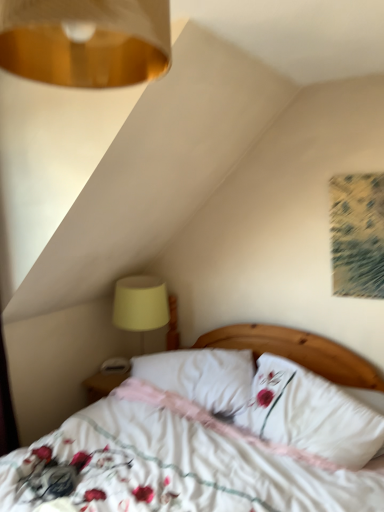
The width and height of the screenshot is (384, 512). What are the coordinates of `white soft pillow at center, the 1th pillow positioned from the right` in the screenshot? It's located at (310, 414).

Locate an element on the screen. white floral fabric bed at center is located at coordinates (180, 463).

What is the approximate width of white floral fabric bed at center?

It is 5.53 feet.

What do you see at coordinates (140, 304) in the screenshot?
I see `yellow fabric lampshade at lower left` at bounding box center [140, 304].

You are a GUI agent. You are given a task and a screenshot of the screen. Output one action in this format:
    pyautogui.click(x=<x>, y=<y>)
    Task: Click on the gold metallic lampshade at upper left
    This screenshot has height=512, width=384.
    Given the screenshot: What is the action you would take?
    pyautogui.click(x=85, y=41)

I want to click on white soft pillow at center, arranged as the first pillow when viewed from the left, so click(x=201, y=376).

Is yellow fabric lampshade at lower left not within white soft pillow at center, arranged as the first pillow when viewed from the left?

Yes, yellow fabric lampshade at lower left is outside of white soft pillow at center, arranged as the first pillow when viewed from the left.

Can you confirm if yellow fabric lampshade at lower left is thinner than white soft pillow at center, arranged as the first pillow when viewed from the left?

Correct, the width of yellow fabric lampshade at lower left is less than that of white soft pillow at center, arranged as the first pillow when viewed from the left.

Which object is further away from the camera, yellow fabric lampshade at lower left or white soft pillow at center, the 2th pillow when ordered from right to left?

yellow fabric lampshade at lower left is behind.

Is gold metallic lampshade at upper left facing towards printed fabric artwork at upper right?

No, gold metallic lampshade at upper left is not turned towards printed fabric artwork at upper right.

In the scene shown: Considering the sizes of objects gold metallic lampshade at upper left and printed fabric artwork at upper right in the image provided, who is smaller, gold metallic lampshade at upper left or printed fabric artwork at upper right?

Smaller between the two is printed fabric artwork at upper right.

How many degrees apart are the facing directions of gold metallic lampshade at upper left and printed fabric artwork at upper right?

The angle between the facing direction of gold metallic lampshade at upper left and the facing direction of printed fabric artwork at upper right is 4.93 degrees.

From a real-world perspective, is gold metallic lampshade at upper left physically located above or below printed fabric artwork at upper right?

gold metallic lampshade at upper left is above printed fabric artwork at upper right.

Considering the relative positions of white soft pillow at center, the 2th pillow from the left, and gold metallic lampshade at upper left in the image provided, is white soft pillow at center, the 2th pillow from the left, to the left of gold metallic lampshade at upper left from the viewer's perspective?

In fact, white soft pillow at center, the 2th pillow from the left, is to the right of gold metallic lampshade at upper left.

Is point (279, 407) positioned before point (105, 37)?

No, it is behind (105, 37).

Based on the photo, from a real-world perspective, is white soft pillow at center, the 2th pillow from the left, physically above gold metallic lampshade at upper left?

No.

Is white soft pillow at center, the 1th pillow positioned from the right, facing away from gold metallic lampshade at upper left?

No, white soft pillow at center, the 1th pillow positioned from the right, is not facing the opposite direction of gold metallic lampshade at upper left.

Between point (64, 60) and point (67, 429), which one is positioned behind?

The point (67, 429) is farther from the camera.

Find the location of a particular element. The height and width of the screenshot is (512, 384). bed lying below the gold metallic lampshade at upper left (from the image's perspective) is located at coordinates (180, 463).

From a real-world perspective, which object stands above the other?

From a 3D spatial view, gold metallic lampshade at upper left is above.

Is gold metallic lampshade at upper left to the left or to the right of white floral fabric bed at center in the image?

Clearly, gold metallic lampshade at upper left is on the left of white floral fabric bed at center in the image.

Is yellow fabric lampshade at lower left surrounded by gold metallic lampshade at upper left?

No, yellow fabric lampshade at lower left is located outside of gold metallic lampshade at upper left.

Is gold metallic lampshade at upper left positioned with its back to yellow fabric lampshade at lower left?

No, gold metallic lampshade at upper left is not facing away from yellow fabric lampshade at lower left.

Consider the image. From the image's perspective, who appears lower, gold metallic lampshade at upper left or yellow fabric lampshade at lower left?

yellow fabric lampshade at lower left is shown below in the image.

Considering the positions of point (23, 32) and point (130, 285), is point (23, 32) closer or farther from the camera than point (130, 285)?

Point (23, 32) is positioned closer to the camera compared to point (130, 285).

Considering the points (277, 334) and (275, 407), which point is behind, point (277, 334) or point (275, 407)?

The point (277, 334) is farther.

In terms of height, does white floral fabric bed at center look taller or shorter compared to white soft pillow at center, the 2th pillow from the left?

white floral fabric bed at center is taller than white soft pillow at center, the 2th pillow from the left.

Which is more to the right, white floral fabric bed at center or white soft pillow at center, the 2th pillow from the left?

white soft pillow at center, the 2th pillow from the left.

Would you say white floral fabric bed at center is inside or outside white soft pillow at center, the 1th pillow positioned from the right?

The correct answer is: outside.

Is white floral fabric bed at center spatially inside gold metallic lampshade at upper left, or outside of it?

white floral fabric bed at center is spatially situated outside gold metallic lampshade at upper left.

From the image's perspective, is white floral fabric bed at center beneath gold metallic lampshade at upper left?

Yes, from the image's perspective, white floral fabric bed at center is below gold metallic lampshade at upper left.

Which is more to the right, white floral fabric bed at center or gold metallic lampshade at upper left?

Positioned to the right is white floral fabric bed at center.

Which object is closer to the camera, white floral fabric bed at center or gold metallic lampshade at upper left?

gold metallic lampshade at upper left.

There is a yellow fabric lampshade at lower left. Where is `the 1st pillow below it (from the image's perspective)`? The image size is (384, 512). the 1st pillow below it (from the image's perspective) is located at coordinates (201, 376).

The image size is (384, 512). I want to click on print behind the gold metallic lampshade at upper left, so click(x=357, y=234).

Considering their positions, is printed fabric artwork at upper right positioned further to white soft pillow at center, the 2th pillow when ordered from right to left, than white soft pillow at center, the 2th pillow from the left?

printed fabric artwork at upper right is positioned further to the anchor white soft pillow at center, the 2th pillow when ordered from right to left.

Looking at the image, which one is located further to yellow fabric lampshade at lower left, printed fabric artwork at upper right or gold metallic lampshade at upper left?

gold metallic lampshade at upper left lies further to yellow fabric lampshade at lower left than the other object.

From the image, which object appears to be farther from yellow fabric lampshade at lower left, gold metallic lampshade at upper left or white soft pillow at center, arranged as the first pillow when viewed from the left?

Based on the image, gold metallic lampshade at upper left appears to be further to yellow fabric lampshade at lower left.

When comparing their distances from gold metallic lampshade at upper left, does printed fabric artwork at upper right or white soft pillow at center, the 1th pillow positioned from the right, seem closer?

Among the two, printed fabric artwork at upper right is located nearer to gold metallic lampshade at upper left.

Considering their positions, is white soft pillow at center, the 1th pillow positioned from the right, positioned further to gold metallic lampshade at upper left than white floral fabric bed at center?

white soft pillow at center, the 1th pillow positioned from the right, is further to gold metallic lampshade at upper left.

When comparing their distances from white soft pillow at center, arranged as the first pillow when viewed from the left, does gold metallic lampshade at upper left or printed fabric artwork at upper right seem closer?

printed fabric artwork at upper right is positioned closer to the anchor white soft pillow at center, arranged as the first pillow when viewed from the left.

Estimate the real-world distances between objects in this image. Which object is further from white soft pillow at center, arranged as the first pillow when viewed from the left, white floral fabric bed at center or white soft pillow at center, the 2th pillow from the left?

white floral fabric bed at center.

Based on their spatial positions, is white soft pillow at center, the 2th pillow from the left, or yellow fabric lampshade at lower left closer to gold metallic lampshade at upper left?

white soft pillow at center, the 2th pillow from the left, is positioned closer to the anchor gold metallic lampshade at upper left.

I want to click on pillow between gold metallic lampshade at upper left and printed fabric artwork at upper right along the z-axis, so [310, 414].

The width and height of the screenshot is (384, 512). In order to click on pillow positioned between white soft pillow at center, the 1th pillow positioned from the right, and yellow fabric lampshade at lower left from near to far in this screenshot , I will do `click(201, 376)`.

The image size is (384, 512). Identify the location of pillow between gold metallic lampshade at upper left and white soft pillow at center, the 2th pillow when ordered from right to left, along the z-axis. (x=310, y=414).

Locate an element on the screen. The image size is (384, 512). pillow between white floral fabric bed at center and white soft pillow at center, the 2th pillow when ordered from right to left, along the z-axis is located at coordinates (310, 414).